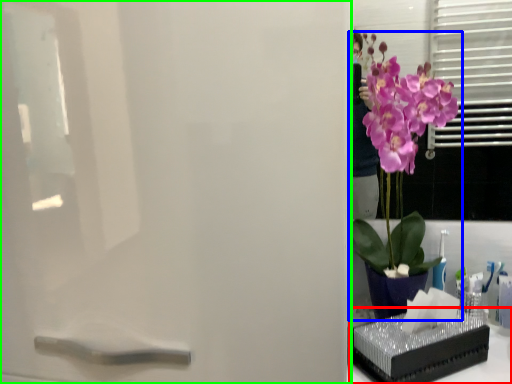
Question: Which object is the closest to the window sill (highlighted by a red box)? Choose among these: houseplant (highlighted by a blue box) or screen door (highlighted by a green box).

Choices:
 (A) houseplant
 (B) screen door

Answer: (A)